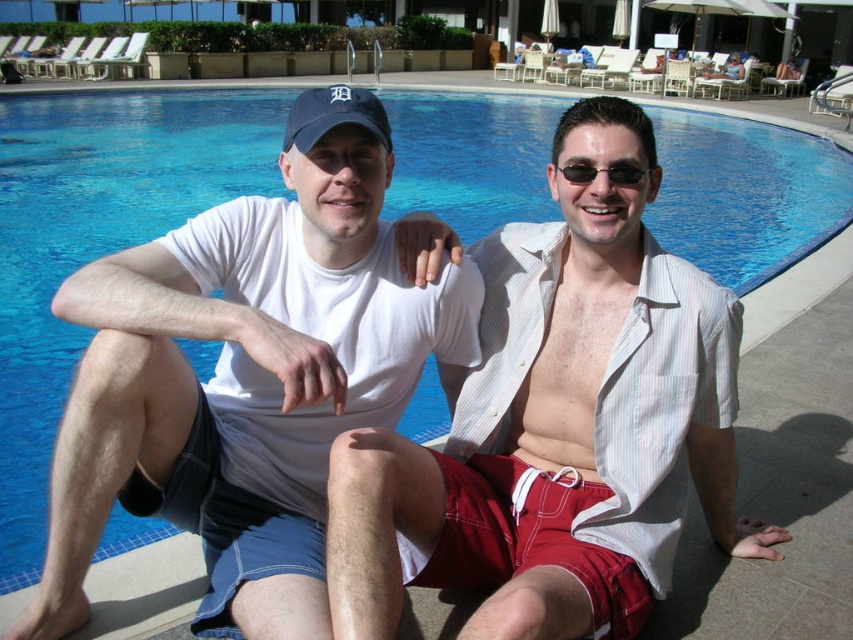
You are a photographer trying to capture a candid shot of the two people by the pool. You notice the white cotton shirt at center and the sunglasses at center. Which object is positioned to the right of the other?

The white cotton shirt at center is to the right of the sunglasses at center.